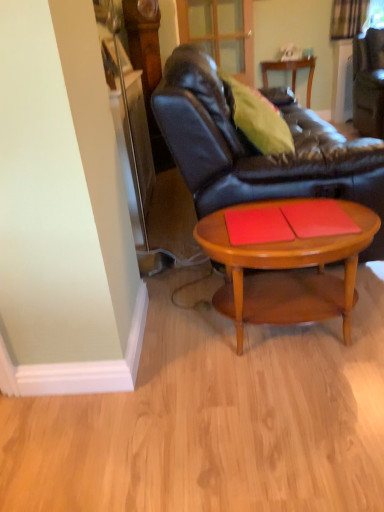
The width and height of the screenshot is (384, 512). In order to click on blank space above red matte book at center, the first plank when ordered from left to right (from a real-world perspective) in this screenshot , I will do `click(251, 222)`.